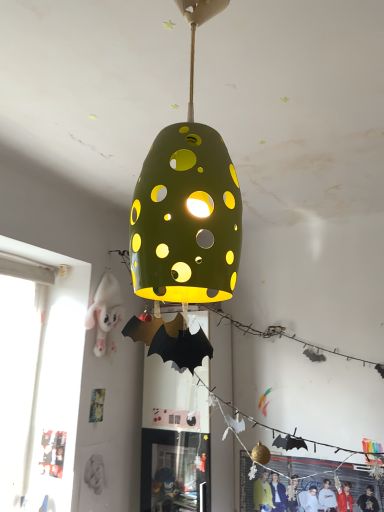
This screenshot has height=512, width=384. I want to click on matte black jacket at lower right, placed as the 1th person when sorted from right to left, so click(311, 492).

You are a GUI agent. You are given a task and a screenshot of the screen. Output one action in this format:
    pyautogui.click(x=<x>, y=<y>)
    Task: Click on the green matte lampshade at center
    
    Given the screenshot: What is the action you would take?
    pyautogui.click(x=187, y=206)

You are a GUI agent. You are given a task and a screenshot of the screen. Output one action in this format:
    pyautogui.click(x=<x>, y=<y>)
    Task: Click on the matte black jacket at lower right, arranged as the 2th person when viewed from the left
    The height and width of the screenshot is (512, 384).
    Given the screenshot: What is the action you would take?
    pyautogui.click(x=311, y=492)

Can you confirm if green matte lampshade at center is taller than matte black jacket at lower right, which is the 2th person from top to bottom?

Yes, green matte lampshade at center is taller than matte black jacket at lower right, which is the 2th person from top to bottom.

Could you measure the distance between green matte lampshade at center and matte black jacket at lower right, placed as the 1th person when sorted from right to left?

A distance of 1.83 meters exists between green matte lampshade at center and matte black jacket at lower right, placed as the 1th person when sorted from right to left.

Is green matte lampshade at center facing away from matte black jacket at lower right, placed as the 1th person when sorted from right to left?

No.

Which is closer to the camera, (162,204) or (282,506)?

Clearly, point (162,204) is closer to the camera than point (282,506).

Is point (116, 309) closer to viewer compared to point (195, 4)?

That is False.

From the image's perspective, which object appears higher, white plush toy at left, which appears as the second person when viewed from the right, or green matte lampshade at center?

green matte lampshade at center, from the image's perspective.

Is white plush toy at left, acting as the 1th person starting from the top, bigger than green matte lampshade at center?

No, white plush toy at left, acting as the 1th person starting from the top, is not bigger than green matte lampshade at center.

Considering the relative positions of white plush toy at left, the 1th person in the left-to-right sequence, and green matte lampshade at center in the image provided, is white plush toy at left, the 1th person in the left-to-right sequence, to the left or to the right of green matte lampshade at center?

From the image, it's evident that white plush toy at left, the 1th person in the left-to-right sequence, is to the left of green matte lampshade at center.

Is white plush toy at left, acting as the 1th person starting from the top, turned away from matte black jacket at lower right, which is the 2th person from top to bottom?

white plush toy at left, acting as the 1th person starting from the top, does not have its back to matte black jacket at lower right, which is the 2th person from top to bottom.

Is white plush toy at left, acting as the 1th person starting from the top, bigger or smaller than matte black jacket at lower right, arranged as the 2th person when viewed from the left?

Considering their sizes, white plush toy at left, acting as the 1th person starting from the top, takes up more space than matte black jacket at lower right, arranged as the 2th person when viewed from the left.

Considering the positions of objects white plush toy at left, the 1th person in the left-to-right sequence, and matte black jacket at lower right, arranged as the 1th person when ordered from the bottom, in the image provided, who is behind, white plush toy at left, the 1th person in the left-to-right sequence, or matte black jacket at lower right, arranged as the 1th person when ordered from the bottom,?

white plush toy at left, the 1th person in the left-to-right sequence, is behind.

Are white plush toy at left, acting as the 1th person starting from the top, and matte black jacket at lower right, which is the 2th person from top to bottom, making contact?

No, white plush toy at left, acting as the 1th person starting from the top, is not touching matte black jacket at lower right, which is the 2th person from top to bottom.

From a real-world perspective, who is located higher, matte black jacket at lower right, placed as the 1th person when sorted from right to left, or green matte lampshade at center?

green matte lampshade at center, from a real-world perspective.

Who is taller, matte black jacket at lower right, arranged as the 1th person when ordered from the bottom, or green matte lampshade at center?

With more height is green matte lampshade at center.

Which is more to the right, matte black jacket at lower right, arranged as the 1th person when ordered from the bottom, or green matte lampshade at center?

matte black jacket at lower right, arranged as the 1th person when ordered from the bottom, is more to the right.

Is matte black jacket at lower right, arranged as the 1th person when ordered from the bottom, turned away from white plush toy at left, acting as the 1th person starting from the top?

No, matte black jacket at lower right, arranged as the 1th person when ordered from the bottom,'s orientation is not away from white plush toy at left, acting as the 1th person starting from the top.

Is matte black jacket at lower right, placed as the 1th person when sorted from right to left, completely or partially outside of white plush toy at left, acting as the 1th person starting from the top?

matte black jacket at lower right, placed as the 1th person when sorted from right to left, lies outside white plush toy at left, acting as the 1th person starting from the top,'s area.

Can you tell me how much matte black jacket at lower right, placed as the 1th person when sorted from right to left, and white plush toy at left, which appears as the second person when viewed from the right, differ in facing direction?

94.1 degrees.

How far apart are matte black jacket at lower right, arranged as the 1th person when ordered from the bottom, and white plush toy at left, which appears as the second person when viewed from the right?

1.18 meters.

Can you confirm if green matte lampshade at center is shorter than white plush toy at left, placed as the 2th person when sorted from bottom to top?

No, green matte lampshade at center is not shorter than white plush toy at left, placed as the 2th person when sorted from bottom to top.

From the image's perspective, would you say green matte lampshade at center is positioned over white plush toy at left, acting as the 1th person starting from the top?

Result: Indeed, from the image's perspective, green matte lampshade at center is shown above white plush toy at left, acting as the 1th person starting from the top.

Is green matte lampshade at center positioned behind white plush toy at left, acting as the 1th person starting from the top?

That is False.

Considering the sizes of objects green matte lampshade at center and white plush toy at left, which appears as the second person when viewed from the right, in the image provided, who is wider, green matte lampshade at center or white plush toy at left, which appears as the second person when viewed from the right,?

green matte lampshade at center.

Where is `the 2nd person positioned below the green matte lampshade at center (from the image's perspective)`? the 2nd person positioned below the green matte lampshade at center (from the image's perspective) is located at coordinates (311, 492).

From a real-world perspective, which person is the 1st one underneath the green matte lampshade at center? Please provide its 2D coordinates.

[(105, 313)]

Considering their positions, is white plush toy at left, acting as the 1th person starting from the top, positioned further to matte black jacket at lower right, which is the 2th person from top to bottom, than green matte lampshade at center?

green matte lampshade at center lies further to matte black jacket at lower right, which is the 2th person from top to bottom, than the other object.

Looking at this image, based on their spatial positions, is green matte lampshade at center or matte black jacket at lower right, placed as the 1th person when sorted from right to left, further from white plush toy at left, placed as the 2th person when sorted from bottom to top?

green matte lampshade at center.

Looking at the image, which one is located closer to green matte lampshade at center, white plush toy at left, acting as the 1th person starting from the top, or matte black jacket at lower right, arranged as the 1th person when ordered from the bottom?

white plush toy at left, acting as the 1th person starting from the top.

Based on their spatial positions, is matte black jacket at lower right, arranged as the 1th person when ordered from the bottom, or white plush toy at left, placed as the 2th person when sorted from bottom to top, closer to green matte lampshade at center?

white plush toy at left, placed as the 2th person when sorted from bottom to top, is closer to green matte lampshade at center.

Which object lies nearer to the anchor point matte black jacket at lower right, arranged as the 1th person when ordered from the bottom, green matte lampshade at center or white plush toy at left, acting as the 1th person starting from the top?

white plush toy at left, acting as the 1th person starting from the top, is positioned closer to the anchor matte black jacket at lower right, arranged as the 1th person when ordered from the bottom.

Based on their spatial positions, is matte black jacket at lower right, which is the 2th person from top to bottom, or green matte lampshade at center further from white plush toy at left, the 1th person in the left-to-right sequence?

green matte lampshade at center is further to white plush toy at left, the 1th person in the left-to-right sequence.

At what (x,y) coordinates should I click in order to perform the action: click on person between green matte lampshade at center and white plush toy at left, acting as the 1th person starting from the top, in the front-back direction. Please return your answer as a coordinate pair (x, y). This screenshot has width=384, height=512. Looking at the image, I should click on (311, 492).